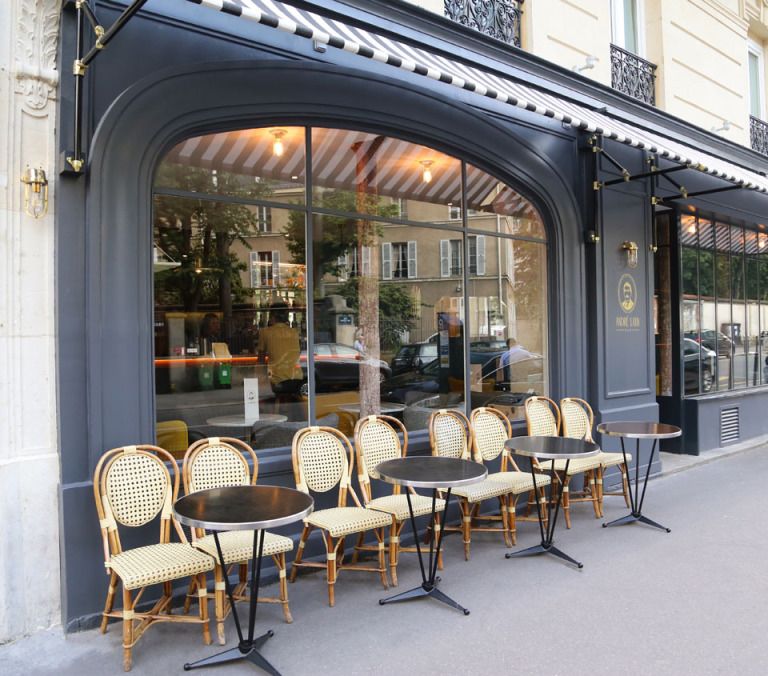
Locate an element on the screen. chair cushoins is located at coordinates pyautogui.click(x=169, y=569), pyautogui.click(x=272, y=546), pyautogui.click(x=339, y=530), pyautogui.click(x=398, y=505), pyautogui.click(x=480, y=489), pyautogui.click(x=518, y=483), pyautogui.click(x=581, y=466), pyautogui.click(x=614, y=457).